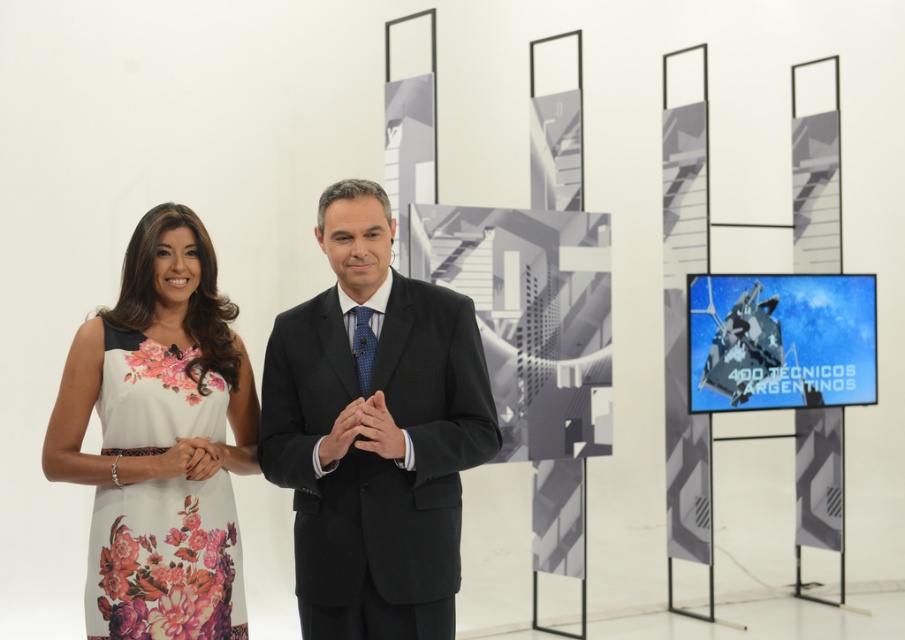
Question: Does black suit at center come behind floral printed fabric dress at left?

Choices:
 (A) no
 (B) yes

Answer: (A)

Question: Does black suit at center appear on the left side of floral printed fabric dress at left?

Choices:
 (A) yes
 (B) no

Answer: (B)

Question: Which point appears closest to the camera in this image?

Choices:
 (A) (138, 410)
 (B) (448, 552)

Answer: (A)

Question: Which object appears farthest from the camera in this image?

Choices:
 (A) floral printed fabric dress at left
 (B) black suit at center

Answer: (A)

Question: Which object is farther from the camera taking this photo?

Choices:
 (A) black suit at center
 (B) floral printed fabric dress at left

Answer: (B)

Question: Is black suit at center above floral printed fabric dress at left?

Choices:
 (A) no
 (B) yes

Answer: (B)